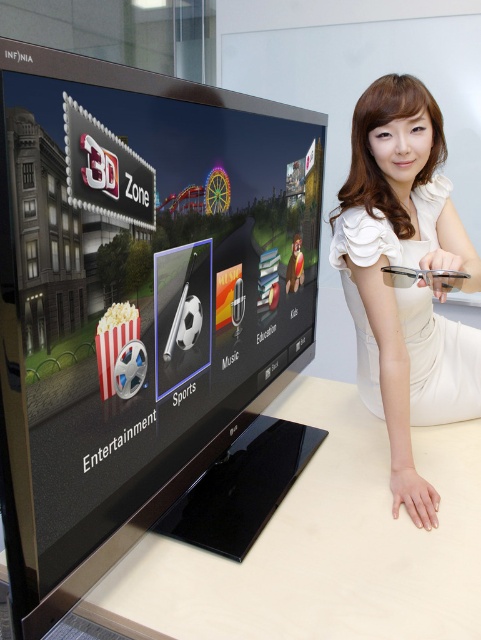
You are looking at the TV screen and see the matte black soccer ball at center and the white paper popcorn at center. Which one is positioned more to the right side of the screen?

The matte black soccer ball at center is positioned to the right of the white paper popcorn at center, so it is more to the right side of the screen.

You are looking at the TV screen and want to touch the point closer to you between the two points, point (218, 324) and point (349, 180). Which point should you touch?

You should touch point (218, 324) because it is closer to the camera than point (349, 180).

You are a guest at a tech exhibition and see the white glossy table at lower center and the white paper popcorn at center. Which object is closer to you?

The white paper popcorn at center is closer to you because it is above the white glossy table at lower center, which is positioned underneath it.